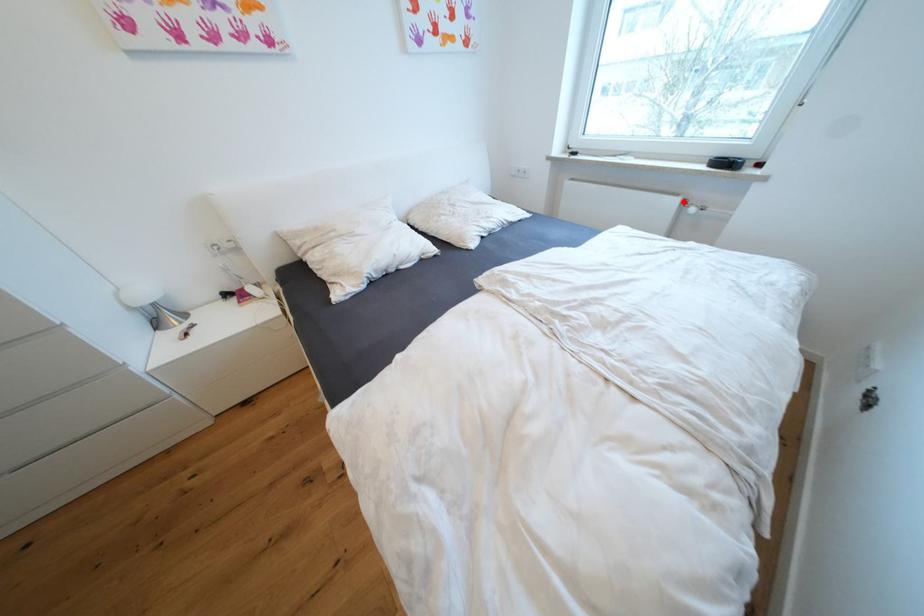
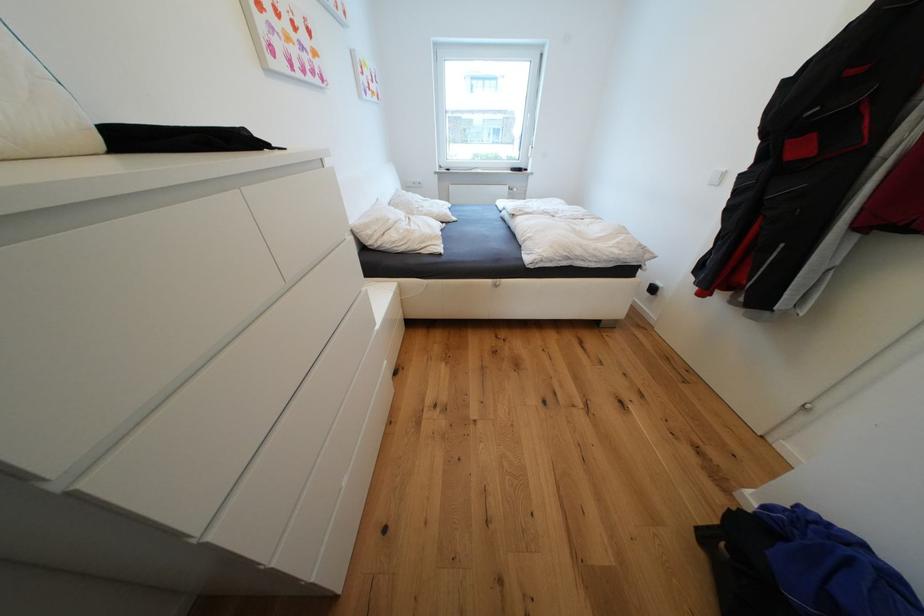
Question: A red point is marked in image1. In image2, is the corresponding 3D point closer to the camera or farther? Reply with the corresponding letter.

Choices:
 (A) The corresponding 3D point is closer.
 (B) The corresponding 3D point is farther.

Answer: (A)